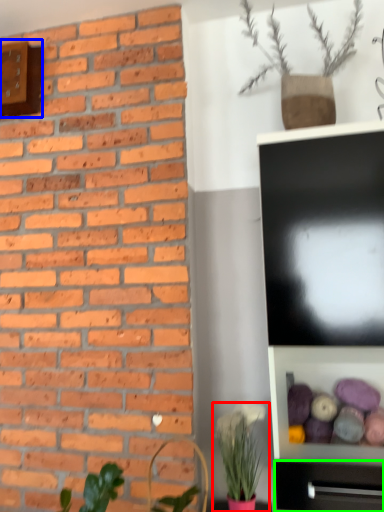
Question: Which is nearer to the houseplant (highlighted by a red box)? clock (highlighted by a blue box) or tv cabinet (highlighted by a green box).

Choices:
 (A) clock
 (B) tv cabinet

Answer: (B)